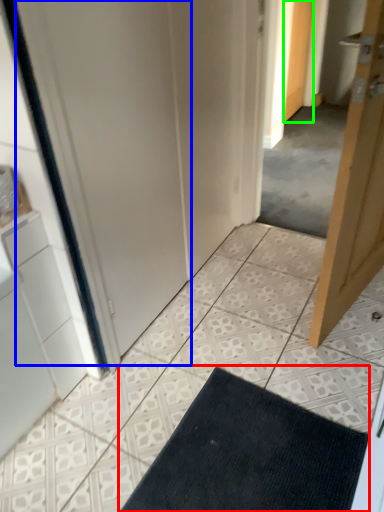
Question: Considering the real-world distances, which object is farthest from bath mat (highlighted by a red box)? screen door (highlighted by a blue box) or door (highlighted by a green box)?

Choices:
 (A) screen door
 (B) door

Answer: (B)